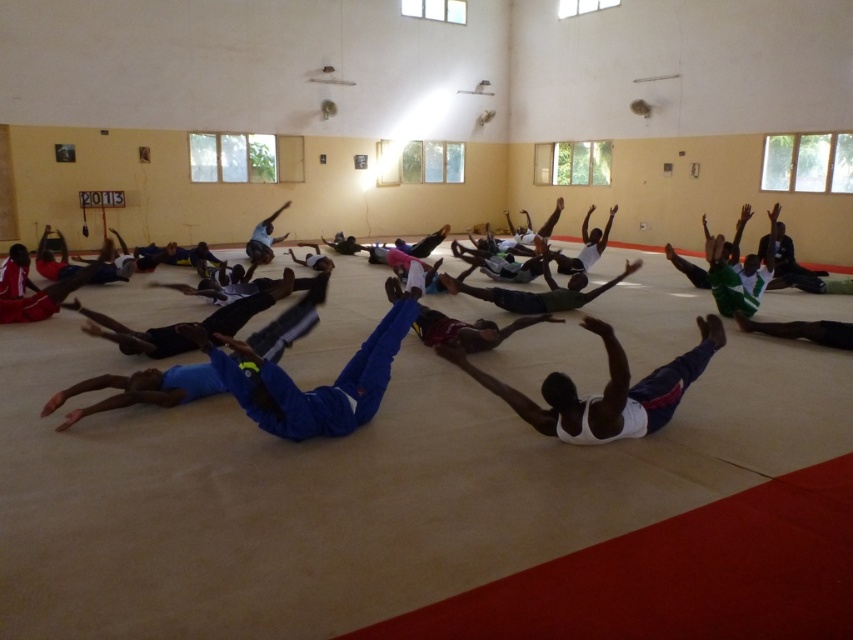
Who is higher up, blue fabric at center or white tank top at center?

Positioned higher is blue fabric at center.

From the picture: Between blue fabric at center and white tank top at center, which one appears on the left side from the viewer's perspective?

Positioned to the left is blue fabric at center.

The image size is (853, 640). What do you see at coordinates (126, 333) in the screenshot?
I see `blue fabric at center` at bounding box center [126, 333].

At what (x,y) coordinates should I click in order to perform the action: click on blue fabric at center. Please return your answer as a coordinate pair (x, y). The width and height of the screenshot is (853, 640). Looking at the image, I should click on (x=126, y=333).